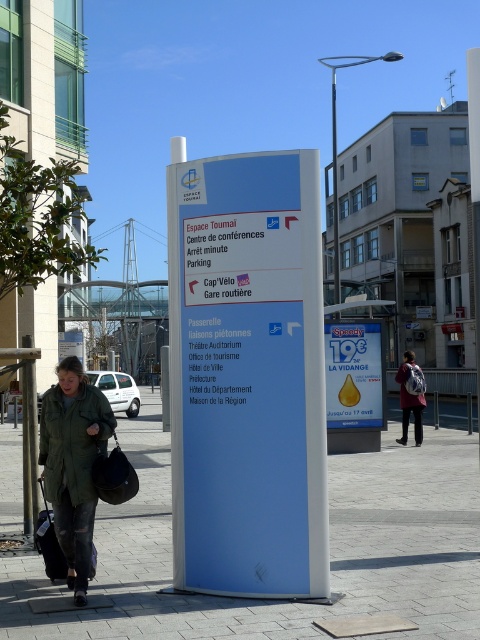
Question: Among these points, which one is farthest from the camera?

Choices:
 (A) (388, 518)
 (B) (69, 490)
 (C) (421, 401)

Answer: (C)

Question: Does blue plastic sign at center appear on the right side of green matte coat at lower left?

Choices:
 (A) yes
 (B) no

Answer: (A)

Question: Which of these objects is positioned closest to the yellow paper sign at center?

Choices:
 (A) blue tile pavement at center
 (B) green matte jacket at lower left
 (C) dark green fabric coat at center

Answer: (C)

Question: Which object is the farthest from the maroon fabric backpack at center?

Choices:
 (A) yellow paper sign at center
 (B) blue plastic sign at center

Answer: (B)

Question: Can you confirm if maroon fabric backpack at center is thinner than dark green fabric coat at center?

Choices:
 (A) yes
 (B) no

Answer: (B)

Question: In this image, where is blue tile pavement at center located relative to green matte jacket at lower left?

Choices:
 (A) below
 (B) above

Answer: (A)